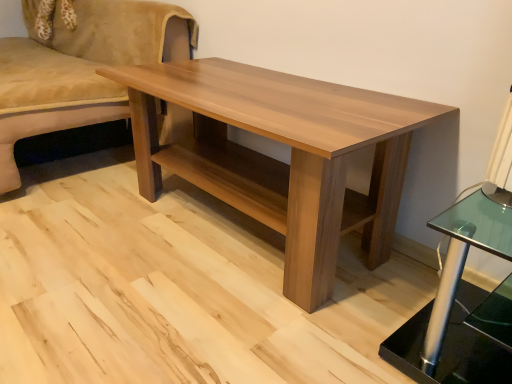
What do you see at coordinates (278, 161) in the screenshot? I see `light brown wood coffee table at center` at bounding box center [278, 161].

This screenshot has width=512, height=384. I want to click on light brown wood coffee table at center, so click(278, 161).

This screenshot has height=384, width=512. Describe the element at coordinates (80, 68) in the screenshot. I see `suede beige studio couch at upper left` at that location.

In order to face suede beige studio couch at upper left, should I rotate leftwards or rightwards?

Turn left by 27.635 degrees to look at suede beige studio couch at upper left.

The width and height of the screenshot is (512, 384). I want to click on suede beige studio couch at upper left, so click(80, 68).

Locate an element on the screen. This screenshot has width=512, height=384. light brown wood coffee table at center is located at coordinates (278, 161).

Is suede beige studio couch at upper left at the left side of light brown wood coffee table at center?

Correct, you'll find suede beige studio couch at upper left to the left of light brown wood coffee table at center.

Is suede beige studio couch at upper left further to camera compared to light brown wood coffee table at center?

Yes, suede beige studio couch at upper left is behind light brown wood coffee table at center.

Which is in front, point (108, 7) or point (377, 217)?

Point (377, 217)

From the image's perspective, is suede beige studio couch at upper left located beneath light brown wood coffee table at center?

Incorrect, from the image's perspective, suede beige studio couch at upper left is higher than light brown wood coffee table at center.

Looking at this image, from a real-world perspective, is suede beige studio couch at upper left beneath light brown wood coffee table at center?

No.

Can you confirm if suede beige studio couch at upper left is thinner than light brown wood coffee table at center?

In fact, suede beige studio couch at upper left might be wider than light brown wood coffee table at center.

Looking at this image, in terms of height, does suede beige studio couch at upper left look taller or shorter compared to light brown wood coffee table at center?

suede beige studio couch at upper left is taller than light brown wood coffee table at center.

Can you confirm if suede beige studio couch at upper left is bigger than light brown wood coffee table at center?

Yes, suede beige studio couch at upper left is bigger than light brown wood coffee table at center.

Can we say suede beige studio couch at upper left lies outside light brown wood coffee table at center?

suede beige studio couch at upper left is positioned outside light brown wood coffee table at center.

Is suede beige studio couch at upper left not near light brown wood coffee table at center?

No, there isn't a large distance between suede beige studio couch at upper left and light brown wood coffee table at center.

Is suede beige studio couch at upper left positioned with its back to light brown wood coffee table at center?

No, suede beige studio couch at upper left's orientation is not away from light brown wood coffee table at center.

Find the location of a particular element. studio couch behind the light brown wood coffee table at center is located at coordinates (80, 68).

Based on the photo, considering the relative positions of light brown wood coffee table at center and suede beige studio couch at upper left in the image provided, is light brown wood coffee table at center to the right of suede beige studio couch at upper left from the viewer's perspective?

Yes.

Considering their positions, is light brown wood coffee table at center located in front of or behind suede beige studio couch at upper left?

light brown wood coffee table at center is in front of suede beige studio couch at upper left.

Is point (141, 76) positioned behind point (89, 54)?

No, it is in front of (89, 54).

From the image's perspective, is light brown wood coffee table at center over suede beige studio couch at upper left?

No.

From a real-world perspective, is light brown wood coffee table at center under suede beige studio couch at upper left?

Yes, from a real-world perspective, light brown wood coffee table at center is beneath suede beige studio couch at upper left.

Looking at their sizes, would you say light brown wood coffee table at center is wider or thinner than suede beige studio couch at upper left?

In the image, light brown wood coffee table at center appears to be more narrow than suede beige studio couch at upper left.

In the scene shown: Which of these two, light brown wood coffee table at center or suede beige studio couch at upper left, stands taller?

suede beige studio couch at upper left.

Who is bigger, light brown wood coffee table at center or suede beige studio couch at upper left?

suede beige studio couch at upper left.

Is light brown wood coffee table at center inside the boundaries of suede beige studio couch at upper left, or outside?

light brown wood coffee table at center is not enclosed by suede beige studio couch at upper left.

Is light brown wood coffee table at center not close to suede beige studio couch at upper left?

They are positioned close to each other.

Does light brown wood coffee table at center turn towards suede beige studio couch at upper left?

No, light brown wood coffee table at center does not turn towards suede beige studio couch at upper left.

How different are the orientations of light brown wood coffee table at center and suede beige studio couch at upper left in degrees?

The angular difference between light brown wood coffee table at center and suede beige studio couch at upper left is 1.01 degrees.

Could you measure the distance between light brown wood coffee table at center and suede beige studio couch at upper left?

light brown wood coffee table at center is 69.29 centimeters from suede beige studio couch at upper left.

Identify the location of studio couch above the light brown wood coffee table at center (from the image's perspective). (x=80, y=68).

This screenshot has height=384, width=512. What are the coordinates of `studio couch on the left side of light brown wood coffee table at center` in the screenshot? It's located at (80, 68).

In order to click on studio couch that is behind the light brown wood coffee table at center in this screenshot , I will do `click(80, 68)`.